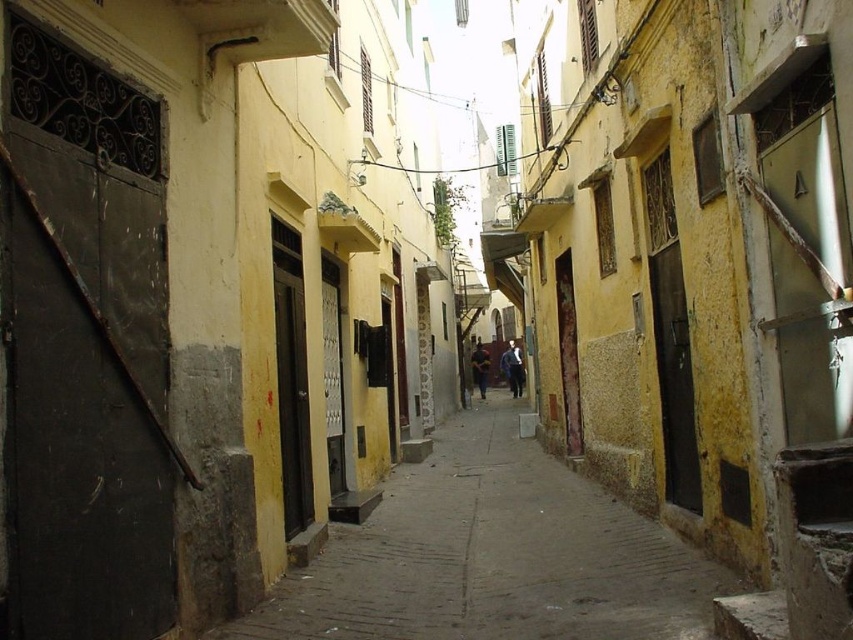
You are a delivery person carrying a large package that is 2 meters wide. You need to navigate through the narrow alleyway shown in the image. Can you pass through the alley safely while keeping the package centered on the smooth concrete pavement at center and blue denim jacket at center?

The smooth concrete pavement at center is wider than the blue denim jacket at center. Since the package is 2 meters wide, you should position it on the smooth concrete pavement at center as it provides enough space for the package to pass through safely.

You are a delivery person carrying a package and need to pass through the narrow alleyway. You see a blue denim jacket at center and a yellow fabric jacket at center hanging from a clothesline above the alley. Which jacket is closer to the ground?

The blue denim jacket at center is located below the yellow fabric jacket at center, so the blue denim jacket at center is closer to the ground.

You are a delivery person carrying a package that is 3 feet long. You are in the alleyway and need to pass between the blue denim jacket at center and the yellow fabric jacket at center. Can you fit through the space between them?

The blue denim jacket at center and yellow fabric jacket at center are 35.84 inches apart from each other. Since 35.84 inches is approximately 2.98 feet, which is slightly less than the 3 feet length of your package, you cannot fit through the space between them.